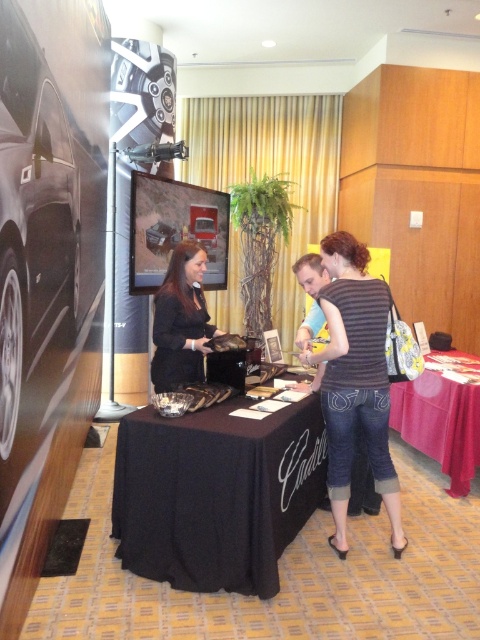
Question: Is striped fabric shirt at center bigger than black matte dress at center?

Choices:
 (A) yes
 (B) no

Answer: (A)

Question: Is black cloth table at center positioned before red fabric table at lower right?

Choices:
 (A) no
 (B) yes

Answer: (B)

Question: Which of these objects is positioned closest to the black cloth table at center?

Choices:
 (A) striped fabric shirt at center
 (B) red fabric table at lower right
 (C) black matte dress at center

Answer: (A)

Question: Which point is closer to the camera?

Choices:
 (A) (165, 381)
 (B) (337, 541)
 (C) (460, 397)

Answer: (B)

Question: Can you confirm if black cloth table at center is thinner than red fabric table at lower right?

Choices:
 (A) yes
 (B) no

Answer: (B)

Question: Which of the following is the closest to the observer?

Choices:
 (A) black matte dress at center
 (B) red fabric table at lower right

Answer: (A)